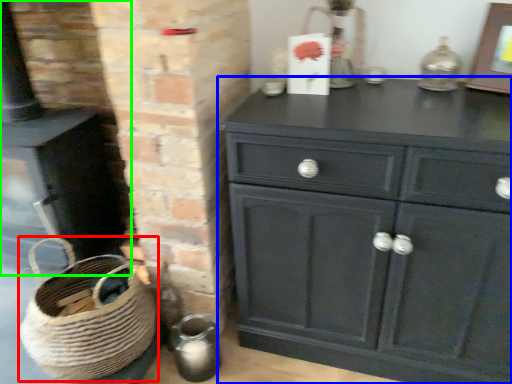
Question: Which is farther away from basket (highlighted by a red box)? chest of drawers (highlighted by a blue box) or fireplace (highlighted by a green box)?

Choices:
 (A) chest of drawers
 (B) fireplace

Answer: (A)